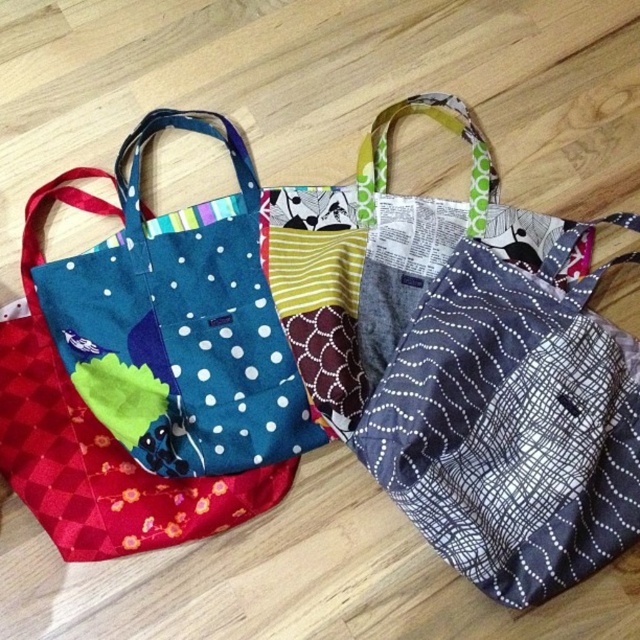
You are organizing a small art exhibit and need to arrange these two items in a display case. The display case has a width of 1.2 meters. The blue fabric tote at left is 40 cm wide, and the gray dotted fabric pocket at center is 30 cm wide. Can both items fit side by side within the display case without overlapping?

The blue fabric tote at left is 40 cm wide and the gray dotted fabric pocket at center is 30 cm wide. Combined, they total 70 cm, which is less than the 120 cm width of the display case. Therefore, both items can fit side by side without overlapping.